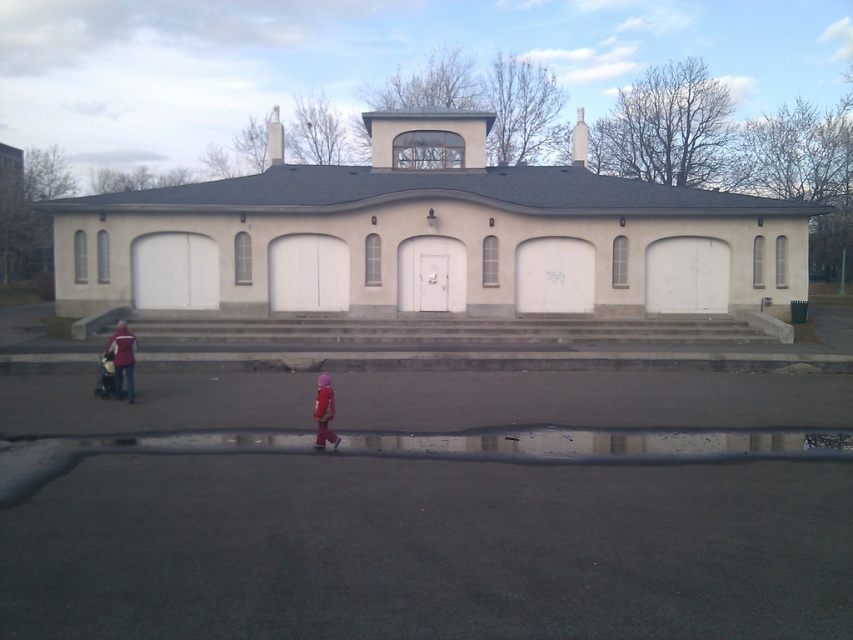
Consider the image. You are standing at the base of the concrete stairs at center and want to pick up the matte red jacket at left. Is the jacket directly in front of the stairs or to the side?

The concrete stairs at center is positioned over matte red jacket at left, so the jacket is directly in front of the stairs.

You are standing at the base of the concrete stairs at center. You want to walk to the front door of the building. How many steps will you have to climb?

The question cannot be answered with the provided information because the number of steps is not mentioned in the description.